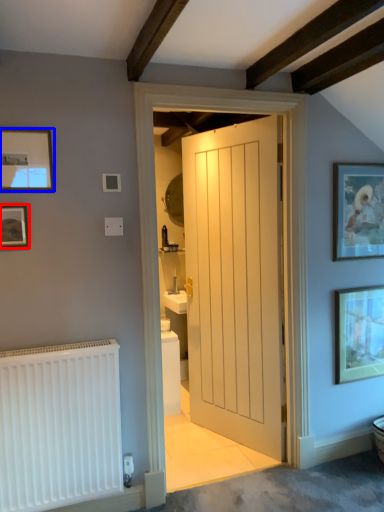
Question: Which object is further to the camera taking this photo, picture frame (highlighted by a red box) or picture frame (highlighted by a blue box)?

Choices:
 (A) picture frame
 (B) picture frame

Answer: (A)